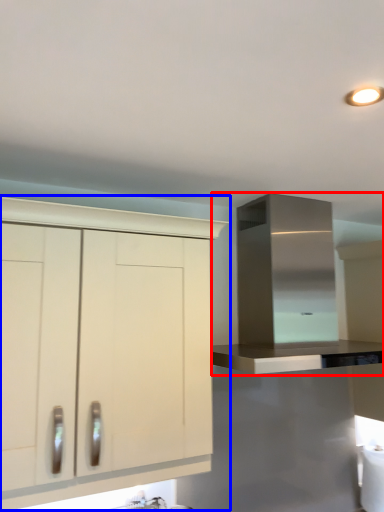
Question: Which of the following is the farthest to the observer, cabinetry (highlighted by a red box) or cabinetry (highlighted by a blue box)?

Choices:
 (A) cabinetry
 (B) cabinetry

Answer: (A)